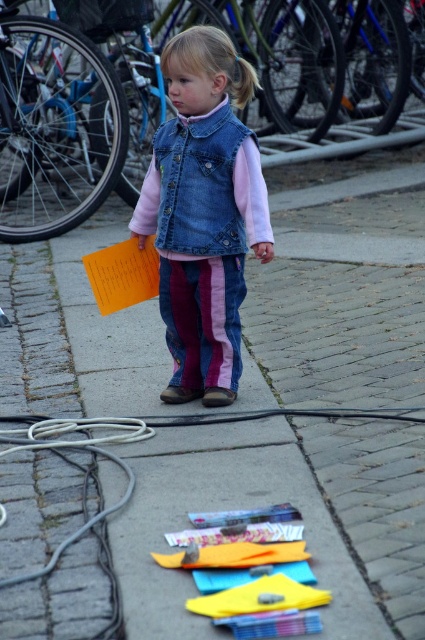
Question: Is denim vest at center above yellow fabric toy at lower center?

Choices:
 (A) yes
 (B) no

Answer: (A)

Question: Does denim vest at center have a lesser width compared to denim jacket at center?

Choices:
 (A) yes
 (B) no

Answer: (B)

Question: Which object is farther from the camera taking this photo?

Choices:
 (A) yellow fabric toy at lower center
 (B) denim jacket at center

Answer: (B)

Question: Considering the real-world distances, which object is farthest from the denim vest at center?

Choices:
 (A) yellow fabric toy at lower center
 (B) denim jacket at center

Answer: (A)

Question: Can you confirm if denim vest at center is wider than denim jacket at center?

Choices:
 (A) yes
 (B) no

Answer: (A)

Question: Which object is closer to the camera taking this photo?

Choices:
 (A) yellow fabric toy at lower center
 (B) denim vest at center
 (C) denim jacket at center

Answer: (A)